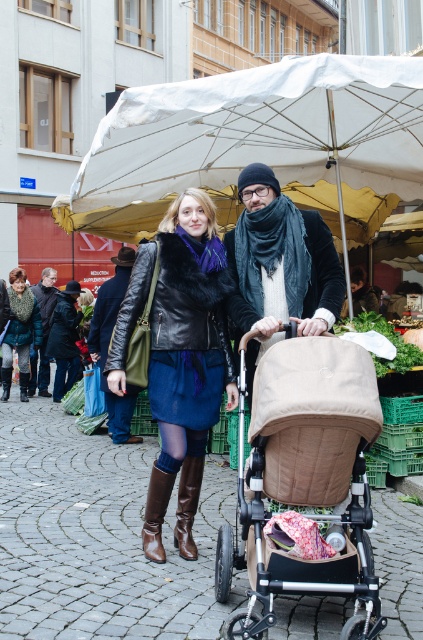
You are a photographer aiming to capture the matte black leather jacket at center and the brown leather boot at lower center in the same frame. Can you focus on both objects clearly without adjusting your camera position?

The matte black leather jacket at center is in front of the brown leather boot at lower center, so focusing on both clearly might be challenging as they are at different distances from the camera.

You are a photographer trying to capture both the matte black leather jacket at center and the brown leather boot at lower center in a single frame. Given their sizes, which object should you focus on to ensure both are clearly visible?

The matte black leather jacket at center is larger in size than the brown leather boot at lower center, so focusing on the jacket will allow both to be visible as the boot will naturally fit into the frame due to its smaller size.